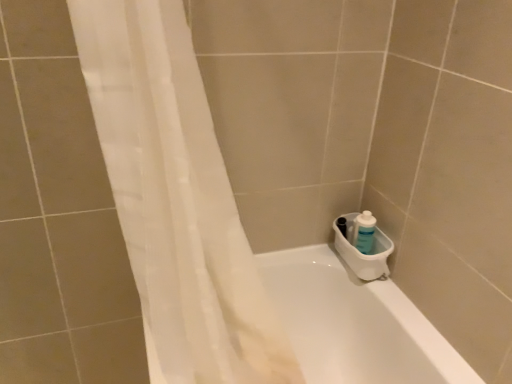
Locate an element on the screen. This screenshot has width=512, height=384. vacant space to the left of blue plastic bottle at right is located at coordinates (323, 263).